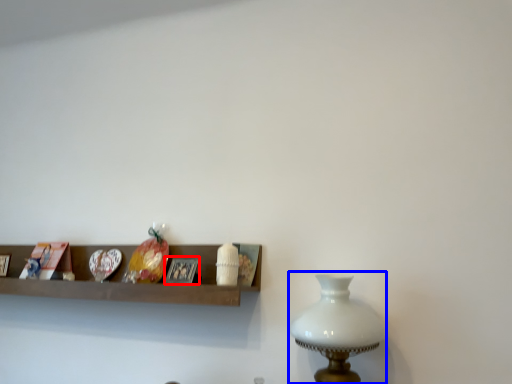
Question: Which point is closer to the camera, picture frame (highlighted by a red box) or table lamp (highlighted by a blue box)?

Choices:
 (A) picture frame
 (B) table lamp

Answer: (B)